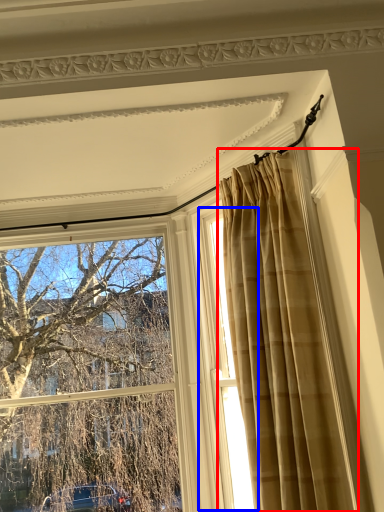
Question: Which object appears farthest to the camera in this image, curtain (highlighted by a red box) or window (highlighted by a blue box)?

Choices:
 (A) curtain
 (B) window

Answer: (B)